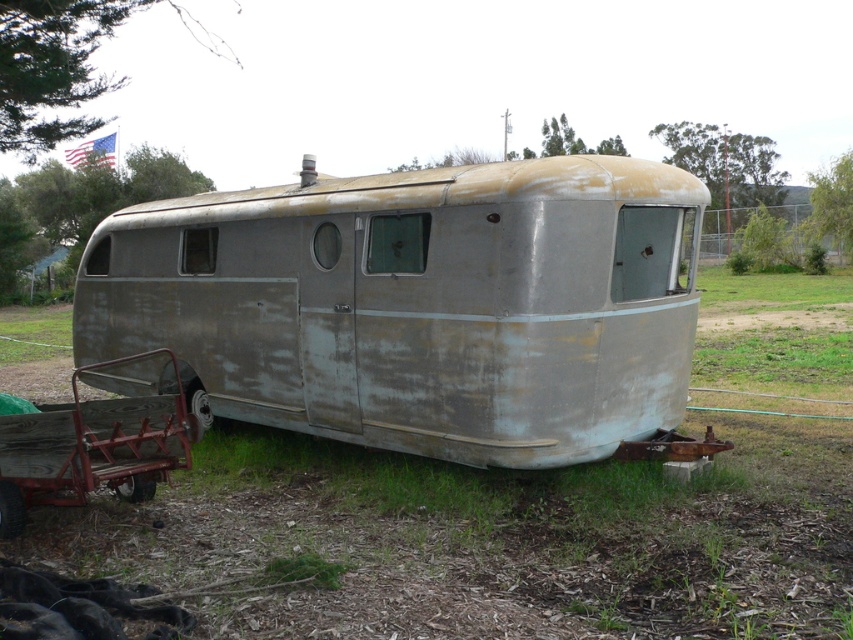
Between rusty metal trailer at center and rusty metal cart at lower left, which one is positioned lower?

rusty metal cart at lower left is lower down.

Consider the image. Can you confirm if rusty metal trailer at center is smaller than rusty metal cart at lower left?

No, rusty metal trailer at center is not smaller than rusty metal cart at lower left.

Where is `rusty metal trailer at center`? This screenshot has width=853, height=640. rusty metal trailer at center is located at coordinates pyautogui.click(x=416, y=305).

Identify the location of rusty metal trailer at center. The image size is (853, 640). (416, 305).